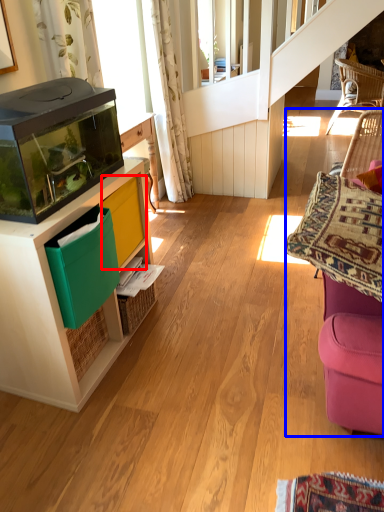
Question: Which object appears farthest to the camera in this image, shelf (highlighted by a red box) or swivel chair (highlighted by a blue box)?

Choices:
 (A) shelf
 (B) swivel chair

Answer: (A)